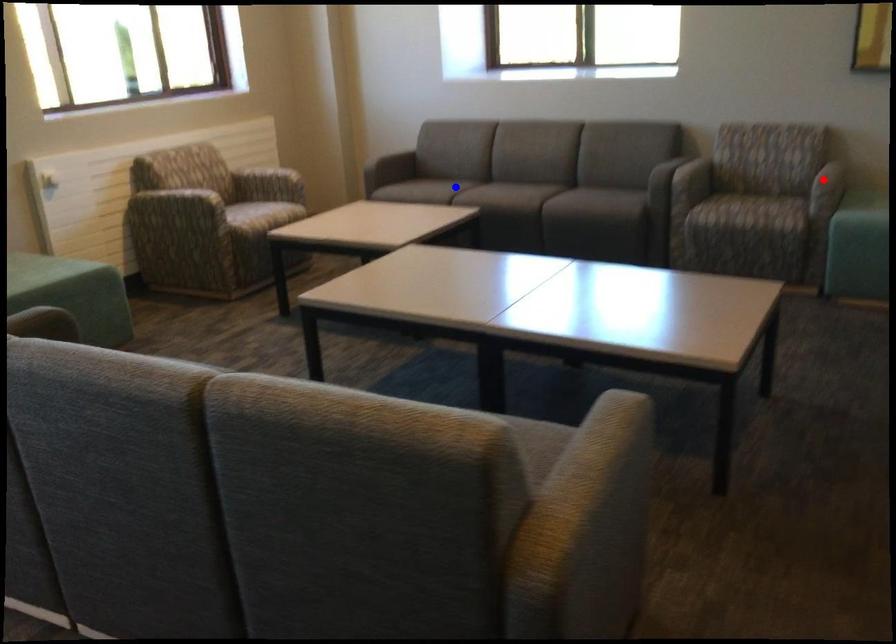
Question: Which of the two points in the image is closer to the camera?

Choices:
 (A) Blue point is closer.
 (B) Red point is closer.

Answer: (B)